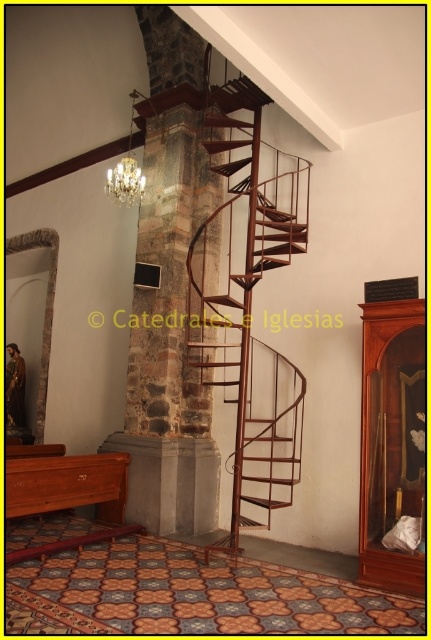
Can you confirm if gold metallic chandelier at upper center is shorter than crystal glass chandelier at upper center?

Yes.

What do you see at coordinates (127, 170) in the screenshot? Image resolution: width=431 pixels, height=640 pixels. I see `gold metallic chandelier at upper center` at bounding box center [127, 170].

Is point (118, 161) farther from viewer compared to point (134, 156)?

Yes, point (118, 161) is behind point (134, 156).

Identify the location of gold metallic chandelier at upper center. This screenshot has height=640, width=431. (127, 170).

The height and width of the screenshot is (640, 431). Describe the element at coordinates (247, 298) in the screenshot. I see `rustic metal spiral staircase at center` at that location.

Does point (203, 346) come in front of point (118, 179)?

That is True.

At what (x,y) coordinates should I click in order to perform the action: click on rustic metal spiral staircase at center. Please return your answer as a coordinate pair (x, y). This screenshot has height=640, width=431. Looking at the image, I should click on (247, 298).

Who is more forward, [303,378] or [131,193]?

Point [303,378]

Who is more distant from viewer, [261,346] or [108,195]?

Positioned behind is point [108,195].

Consider the image. Who is more distant from viewer, (x=272, y=397) or (x=131, y=195)?

Positioned behind is point (x=131, y=195).

Find the location of a particular element. The width and height of the screenshot is (431, 640). rustic metal spiral staircase at center is located at coordinates (247, 298).